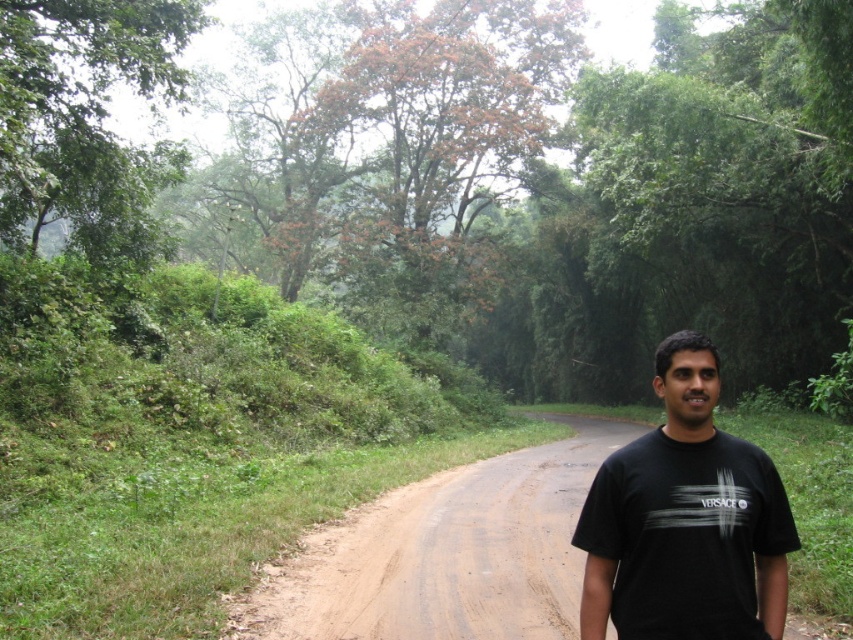
You are standing on the dirt road in the forest and see two points marked in the image. Which point is closer to you, point (480, 540) or point (715, 372)?

Point (715, 372) is closer to you because it is less further to the camera than point (480, 540).